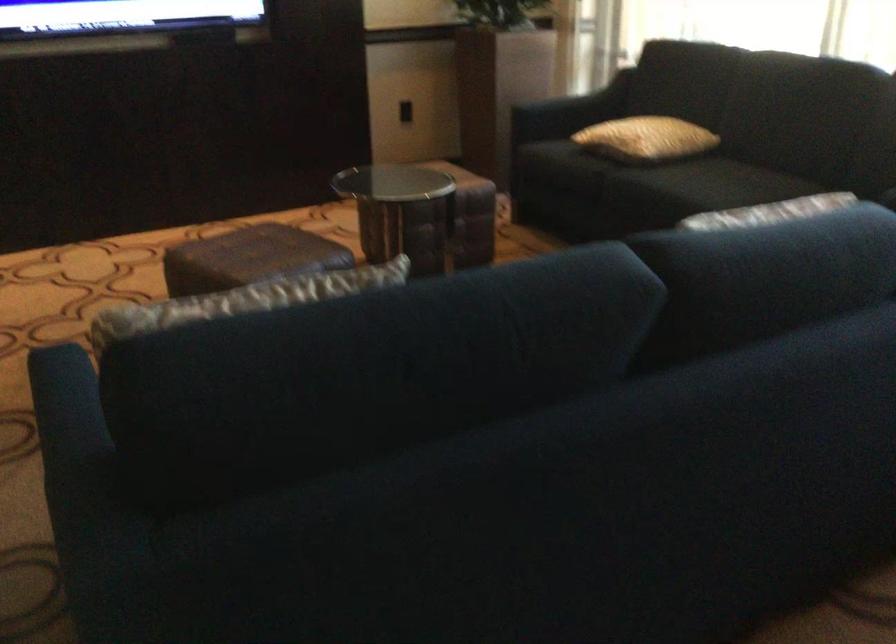
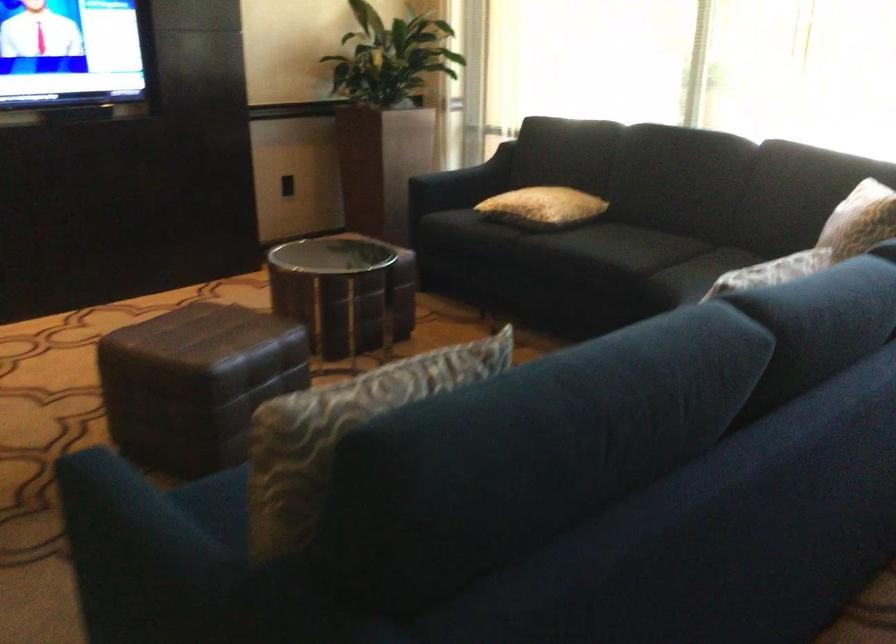
The point at (640,138) is marked in the first image. Where is the corresponding point in the second image?

(543, 207)